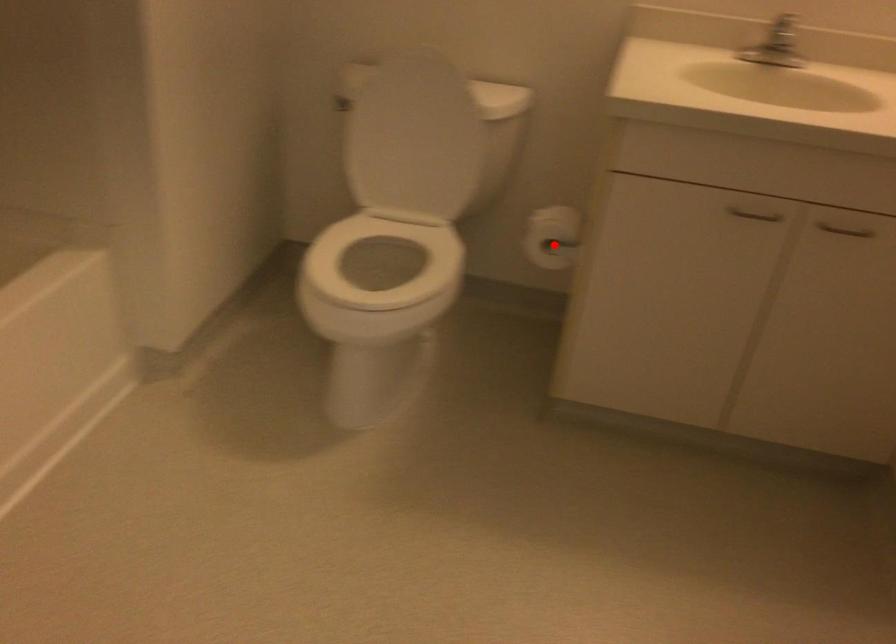
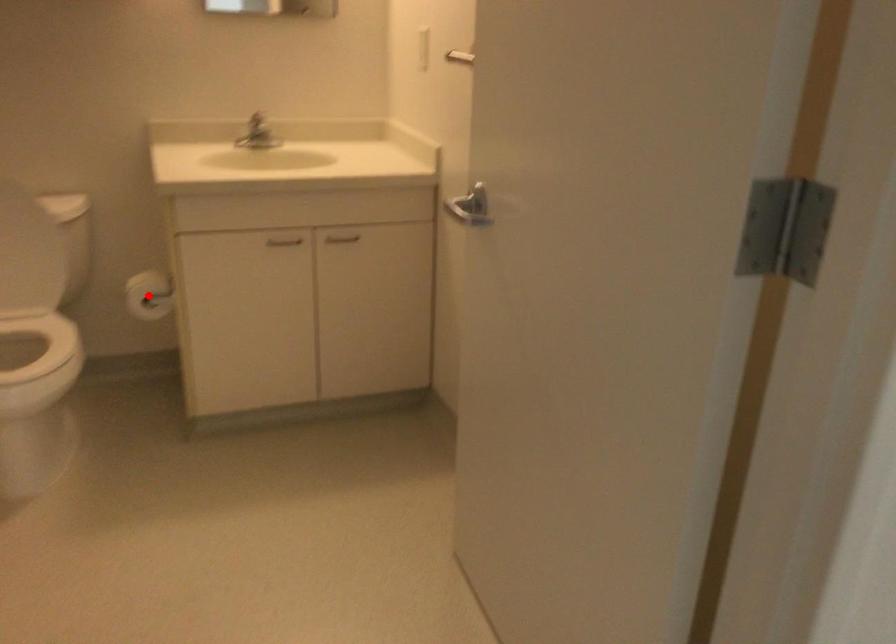
I am providing you with two images of the same scene from different viewpoints. A red point is marked on the first image and another point is marked on the second image. Is the marked point in image1 the same physical position as the marked point in image2?

Yes